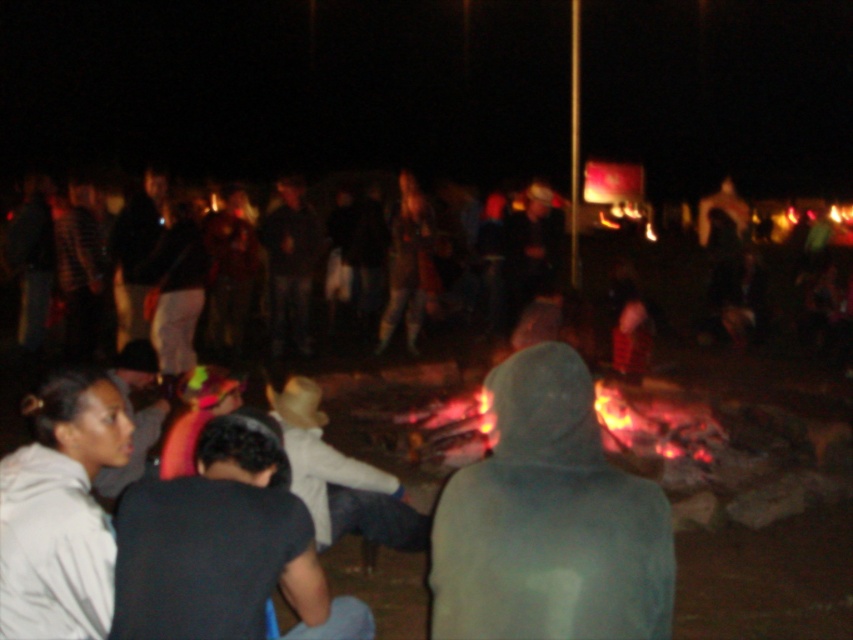
You are at the campfire scene. You want to find the gray fleece hoodie at center. Where is it located in the image?

The gray fleece hoodie at center is located at the coordinates 0.814 on the x axis and 0.645 on the y axis.

You are standing at the center of the campfire and want to hand a marshmallow to the person wearing the gray hoodie at lower left. In terms of direction, which way should you turn to face them?

The gray hoodie at lower left is located at point (61,509), which is to the lower left direction from the center. So you should turn to face the lower left direction to hand the marshmallow to them.

You are standing at the edge of the campfire scene. You notice a point marked at coordinates (549, 520). What object is located at this point?

The point at coordinates (549, 520) corresponds to the gray fleece hoodie at center.